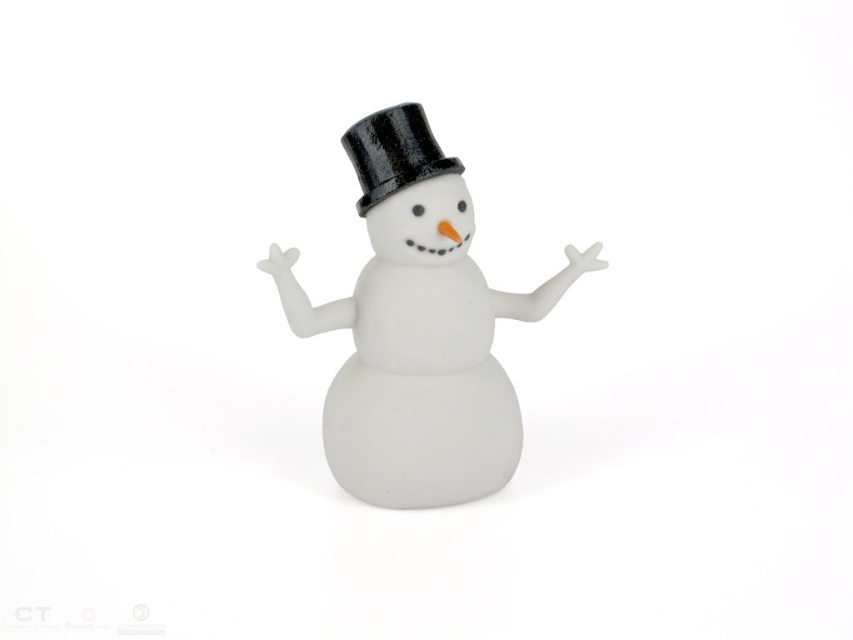
You are standing in a room with a plain white wall. You see the satin white snowman at center. If you want to take a photo of it with your smartphone camera, which has a minimum focus distance of 4 feet, will you need to move closer or farther away to get it in focus?

The satin white snowman at center is 3.95 feet away from camera, so you need to move farther away to get it in focus since it is currently within the minimum focus distance of 4 feet.

You are an artist trying to draw the scene. You have a small piece of paper that can only fit objects up to the size of the black glossy dress hat at center. Can you fit the satin white snowman at center on this paper?

The satin white snowman at center is larger than the black glossy dress hat at center, so it cannot fit on the paper designed for the smaller object.

You are a toy maker who needs to package the satin white snowman at center and the black glossy dress hat at center into a box. The box has a length of 6 inches. Can you fit both items inside the box without overlapping?

The satin white snowman at center is 5.88 inches away from the black glossy dress hat at center. Since the total distance between them is less than the box length of 6 inches, they can be placed side by side within the box without overlapping.